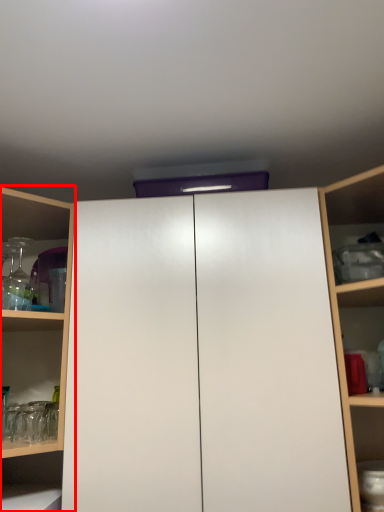
Question: In this image, where is shelf (annotated by the red box) located relative to cupboard?

Choices:
 (A) left
 (B) right

Answer: (A)